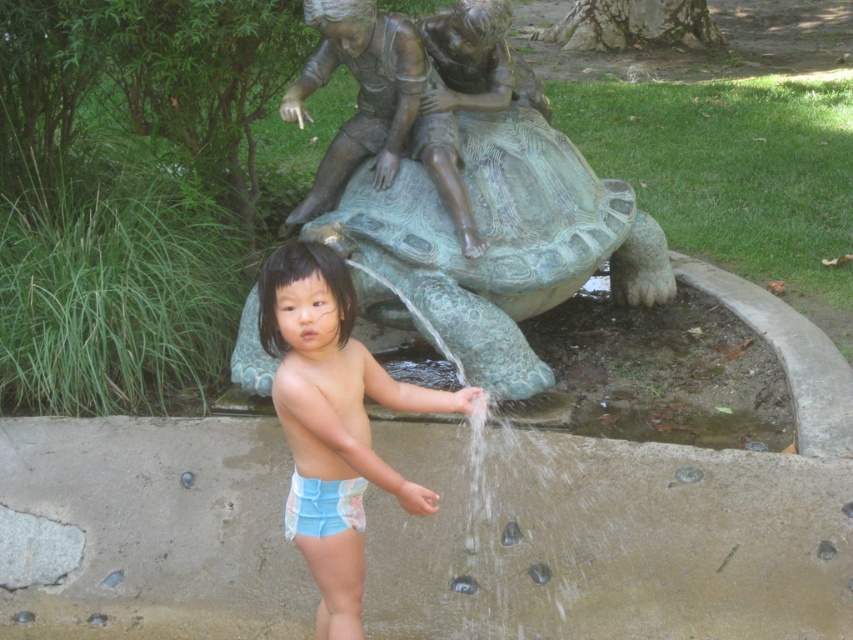
The width and height of the screenshot is (853, 640). What do you see at coordinates (334, 420) in the screenshot?
I see `blue fabric shorts at center` at bounding box center [334, 420].

Does blue fabric shorts at center have a larger size compared to bronze textured turtle at center?

Actually, blue fabric shorts at center might be smaller than bronze textured turtle at center.

Find the location of a particular element. This screenshot has height=640, width=853. blue fabric shorts at center is located at coordinates (334, 420).

Between point (416, 54) and point (474, 106), which one is positioned in front?

Point (416, 54) is in front.

How distant is bronze statue at center from bronze textured turtle at center?

bronze statue at center and bronze textured turtle at center are 6.53 inches apart from each other.

The image size is (853, 640). Identify the location of bronze statue at center. tap(468, 193).

Find the location of `bronze statue at center`. bronze statue at center is located at coordinates (468, 193).

Is blue fabric shorts at center bigger than blue printed fabric diaper at lower center?

Yes, blue fabric shorts at center is bigger than blue printed fabric diaper at lower center.

Between blue fabric shorts at center and blue printed fabric diaper at lower center, which one appears on the right side from the viewer's perspective?

Positioned to the right is blue fabric shorts at center.

The width and height of the screenshot is (853, 640). Describe the element at coordinates (334, 420) in the screenshot. I see `blue fabric shorts at center` at that location.

Where is `blue fabric shorts at center`? The image size is (853, 640). blue fabric shorts at center is located at coordinates (334, 420).